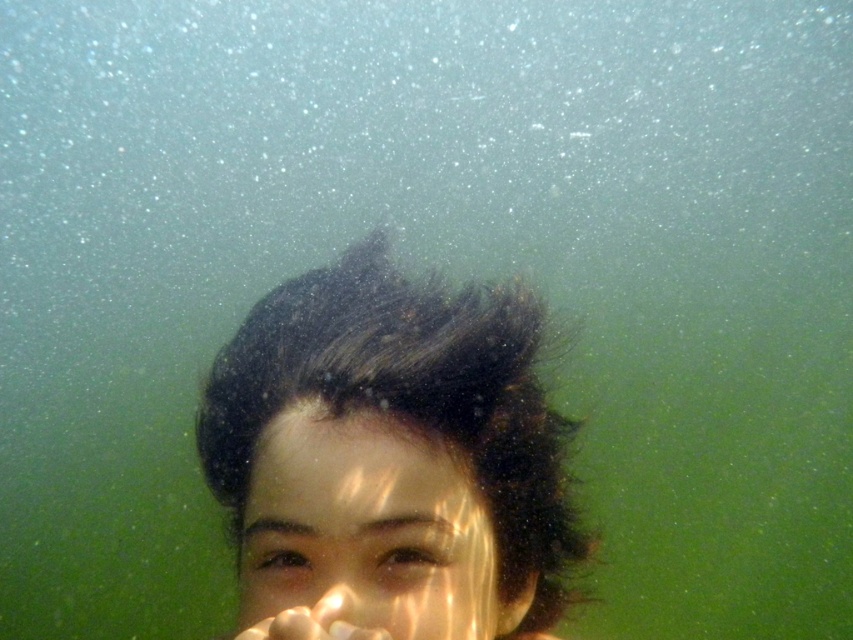
Which is more to the right, dark brown hair at center or translucent wet skin at center?

From the viewer's perspective, dark brown hair at center appears more on the right side.

Who is lower down, dark brown hair at center or translucent wet skin at center?

→ translucent wet skin at center is below.

Between point (305, 285) and point (238, 568), which one is positioned behind?

The point (305, 285) is more distant.

Identify the location of dark brown hair at center. The width and height of the screenshot is (853, 640). click(389, 460).